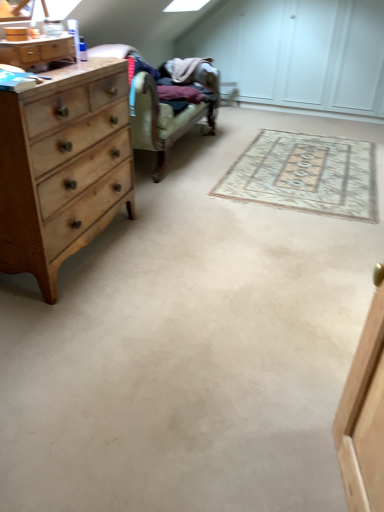
The image size is (384, 512). Find the location of `spots to the right of light brown wood chest of drawers at left`. spots to the right of light brown wood chest of drawers at left is located at coordinates (187, 251).